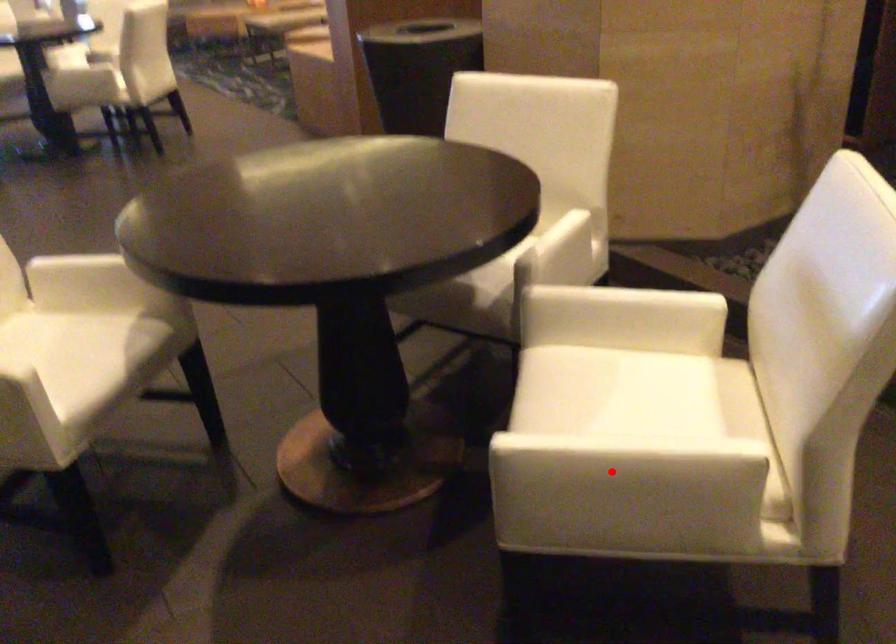
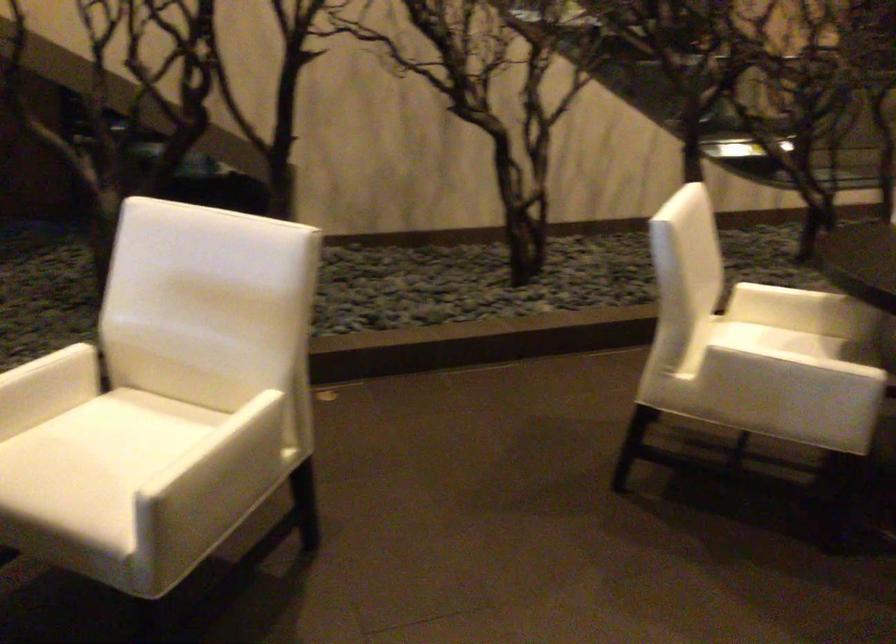
Question: I am providing you with two images of the same scene from different viewpoints. In image1, a red point is highlighted. Considering the same 3D point in image2, which of the following is correct?

Choices:
 (A) It is closer
 (B) It is farther

Answer: (B)